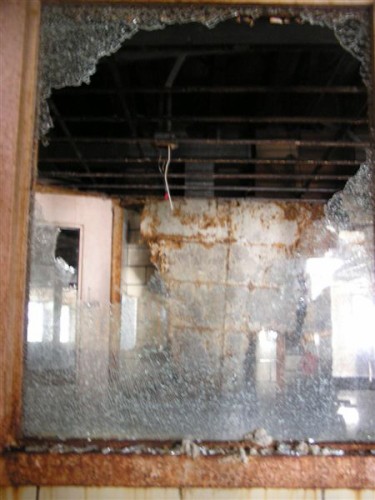
The image size is (375, 500). In order to click on ceiling inside windwo in this screenshot , I will do `click(127, 148)`, `click(290, 150)`.